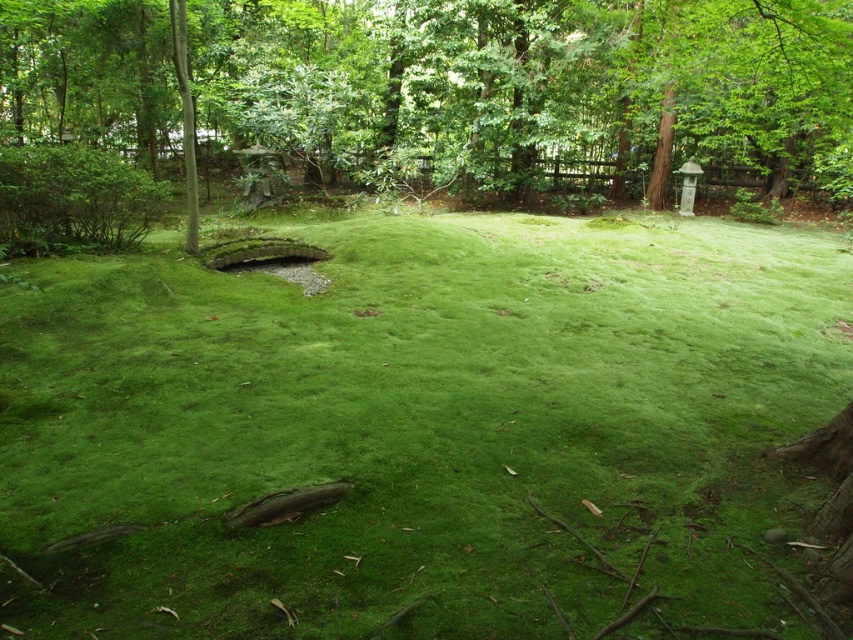
Who is positioned more to the left, green mossy ground at center or green leafy tree at center?

green leafy tree at center is more to the left.

Is point (537, 368) positioned in front of point (692, 115)?

Yes, point (537, 368) is closer to viewer.

In order to click on green mossy ground at center in this screenshot , I will do point(421,428).